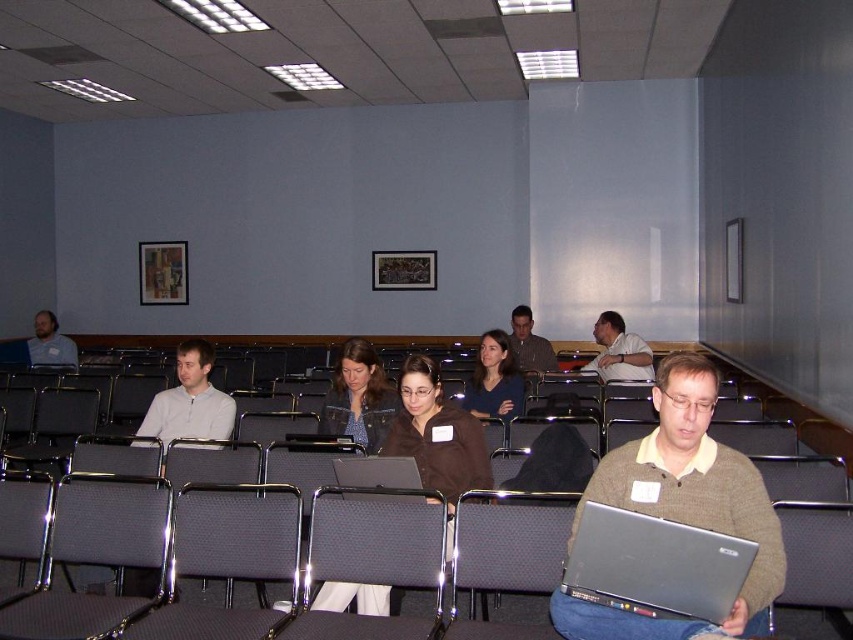
Is silver metallic laptop at lower right further to the viewer compared to gray fabric chair at center?

That is False.

How distant is silver metallic laptop at lower right from gray fabric chair at center?

1.50 meters

The width and height of the screenshot is (853, 640). I want to click on silver metallic laptop at lower right, so click(654, 564).

This screenshot has height=640, width=853. I want to click on silver metallic laptop at lower right, so click(x=654, y=564).

Between silver metallic laptop at lower right and matte white shirt at center, which one is positioned lower?

matte white shirt at center is below.

Between silver metallic laptop at lower right and matte white shirt at center, which one has more height?

With more height is matte white shirt at center.

Is point (672, 608) in front of point (161, 433)?

Yes, point (672, 608) is in front of point (161, 433).

Where is `silver metallic laptop at lower right`? The image size is (853, 640). silver metallic laptop at lower right is located at coordinates (654, 564).

Can you confirm if gray fabric chair at center is taller than silver metallic laptop at center?

Yes.

Is point (740, 442) behind point (407, 465)?

Yes, point (740, 442) is behind point (407, 465).

The height and width of the screenshot is (640, 853). What are the coordinates of `gray fabric chair at center` in the screenshot? It's located at (798, 440).